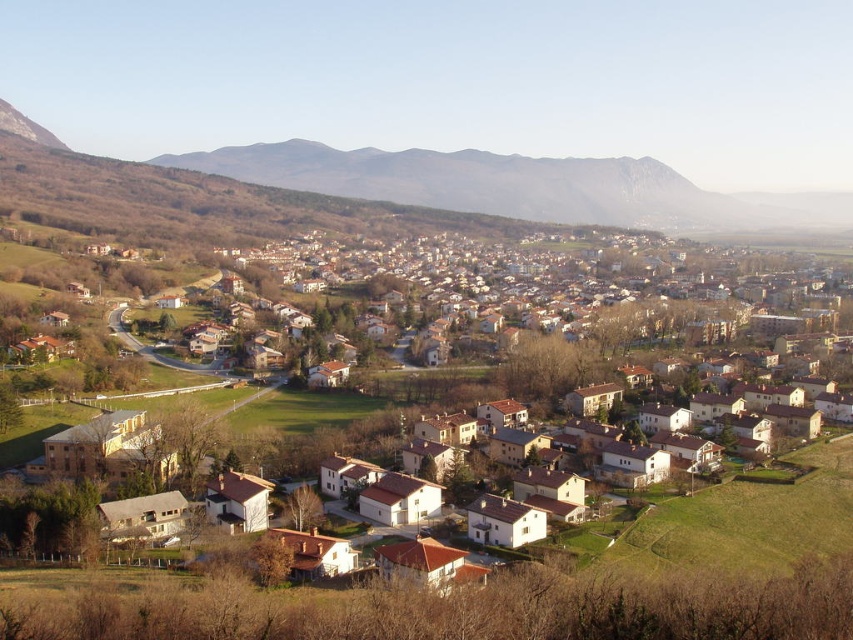
Which is more to the left, white matte houses at center or brown rocky mountain at upper center?

brown rocky mountain at upper center is more to the left.

Identify the location of white matte houses at center. This screenshot has width=853, height=640. (590, 408).

Which is in front, point (646, 394) or point (566, 188)?

Point (646, 394) is more forward.

What are the coordinates of `white matte houses at center` in the screenshot? It's located at (590, 408).